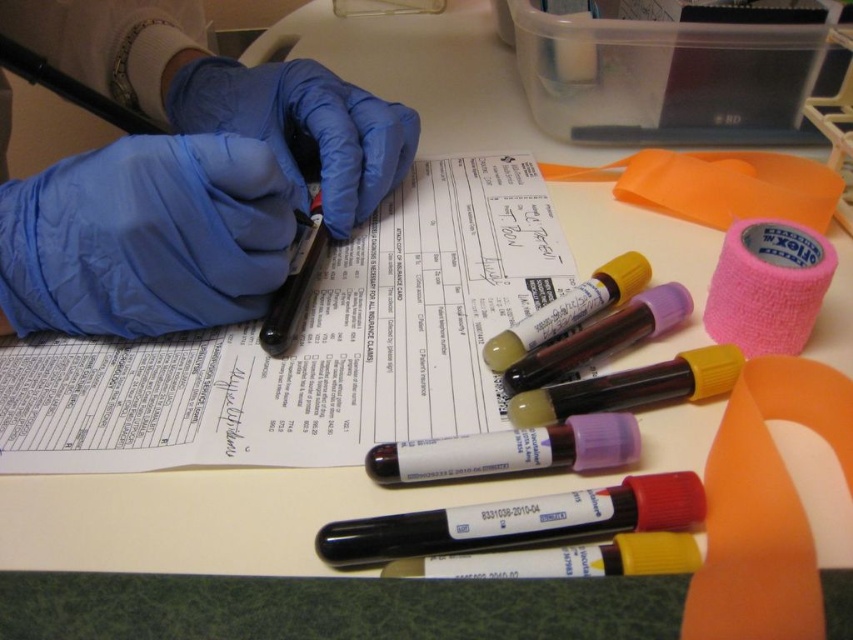
Question: Is white paper at center below pink fabric tape at upper right?

Choices:
 (A) no
 (B) yes

Answer: (B)

Question: Is white paper at center above blue rubber glove at center?

Choices:
 (A) no
 (B) yes

Answer: (A)

Question: Which point appears closest to the camera in this image?

Choices:
 (A) (730, 253)
 (B) (108, 444)

Answer: (B)

Question: Which object is closer to the camera taking this photo?

Choices:
 (A) blue latex glove at upper left
 (B) blue rubber glove at upper left
 (C) blue rubber glove at center
 (D) pink fabric tape at upper right

Answer: (D)

Question: Does blue rubber glove at upper left appear over pink fabric tape at upper right?

Choices:
 (A) no
 (B) yes

Answer: (B)

Question: Which object is farther from the camera taking this photo?

Choices:
 (A) white paper at center
 (B) blue rubber glove at center
 (C) blue rubber glove at upper left
 (D) pink fabric tape at upper right

Answer: (B)